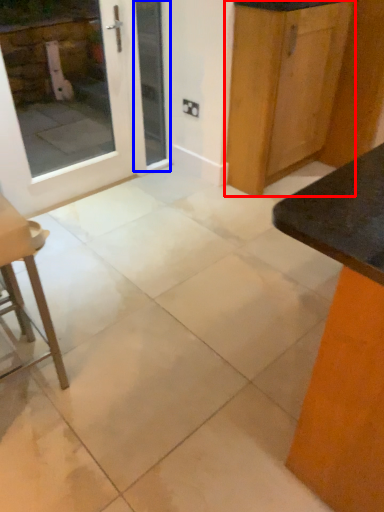
Question: Which object appears farthest to the camera in this image, cabinetry (highlighted by a red box) or screen door (highlighted by a blue box)?

Choices:
 (A) cabinetry
 (B) screen door

Answer: (B)